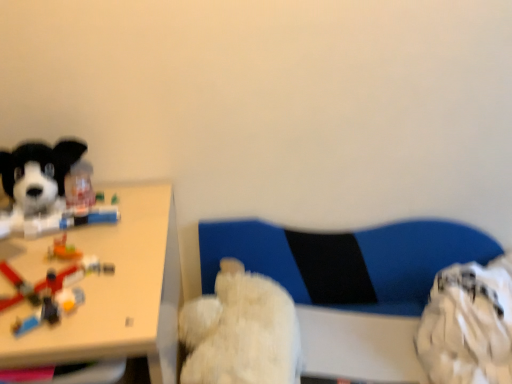
Locate an element on the screen. The image size is (512, 384). free spot below translucent plastic toy at left (from a real-world perspective) is located at coordinates (42, 280).